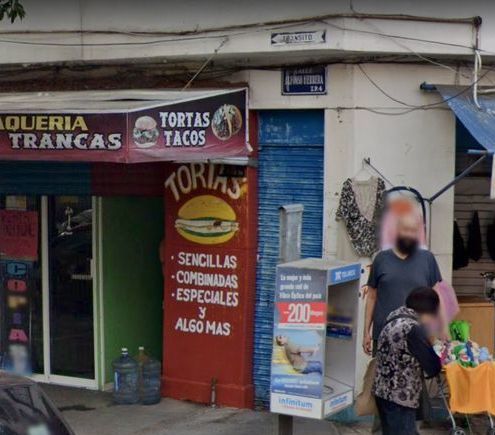
Locate an element on the screen. The image size is (495, 435). water jug is located at coordinates (129, 377), (155, 378), (140, 354).